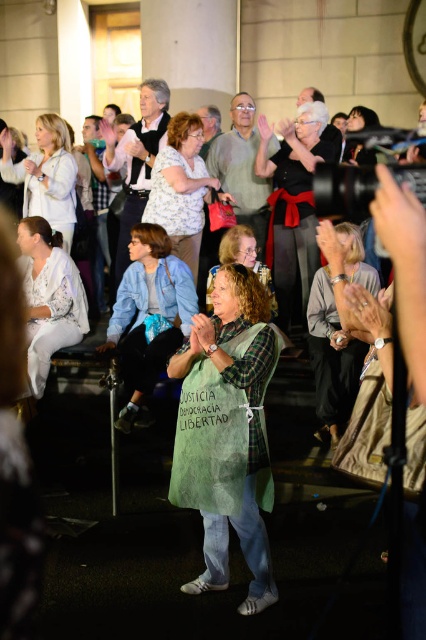
Can you confirm if white fabric at left is positioned below black plastic camera at center right?

Indeed, white fabric at left is positioned under black plastic camera at center right.

Which of these two, white fabric at left or black plastic camera at center right, stands taller?

Standing taller between the two is white fabric at left.

Which is behind, point (81, 301) or point (400, 179)?

The point (81, 301) is more distant.

Identify the location of white fabric at left. (48, 298).

What do you see at coordinates (293, 202) in the screenshot? I see `black fabric dress at center` at bounding box center [293, 202].

Does black fabric dress at center have a larger size compared to matte pink purse at center?

Correct, black fabric dress at center is larger in size than matte pink purse at center.

At what (x,y) coordinates should I click in order to perform the action: click on black fabric dress at center. Please return your answer as a coordinate pair (x, y). The height and width of the screenshot is (640, 426). Looking at the image, I should click on coord(293,202).

Find the location of a particular element. This screenshot has height=640, width=426. black fabric dress at center is located at coordinates (293, 202).

Who is shorter, black fabric dress at center or matte white blouse at upper left?

matte white blouse at upper left is shorter.

Is black fabric dress at center positioned before matte white blouse at upper left?

Yes, black fabric dress at center is in front of matte white blouse at upper left.

Which is behind, point (296, 129) or point (66, 209)?

Point (66, 209)

At what (x,y) coordinates should I click in order to perform the action: click on black fabric dress at center. Please return your answer as a coordinate pair (x, y). The height and width of the screenshot is (640, 426). Looking at the image, I should click on (293, 202).